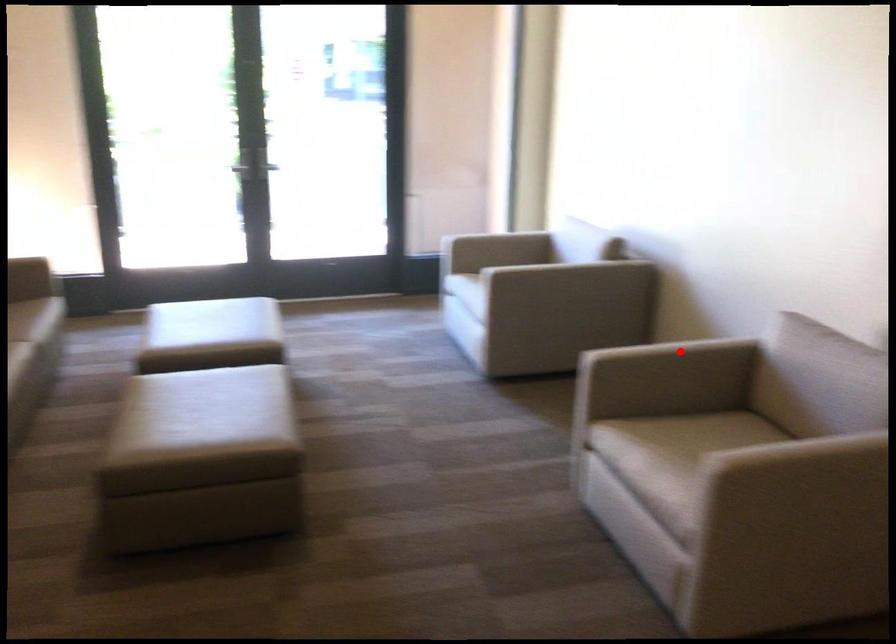
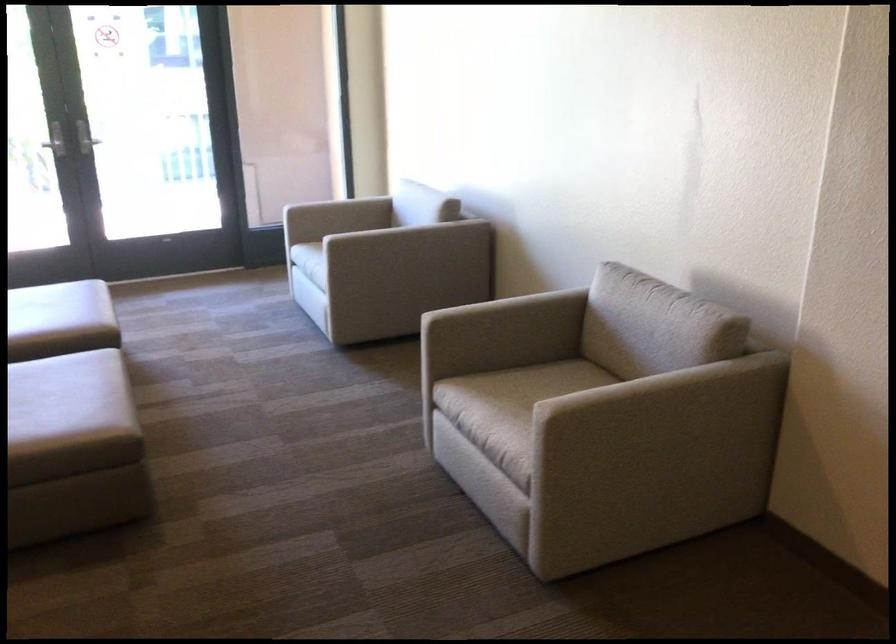
Find the pixel in the second image that matches the highlighted location in the first image.

(513, 304)